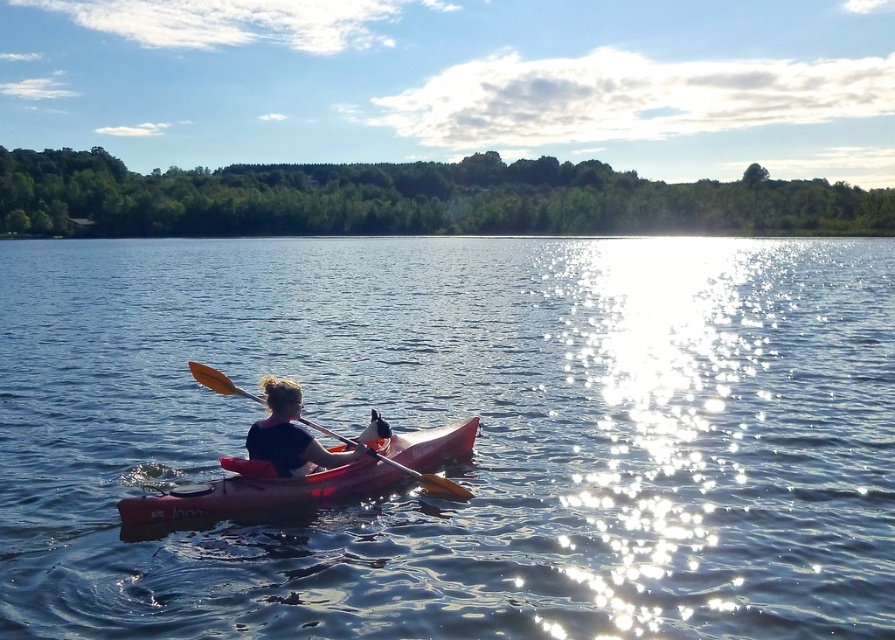
You are a photographer trying to capture the matte pink kayak at center in the image. The camera you are using has a fixed focus point at coordinates point (290, 435). Will this focus point align with the kayak?

Yes, the point (290, 435) marks the matte pink kayak at center, so the focus point will align with it.

You are a photographer trying to capture the matte red canoe at center and the orange wood paddle at center in a single shot. Since you want the canoe to be the main focus, which object should you adjust your camera lens to prioritize in terms of depth of field?

The matte red canoe at center is closer to the viewer than the orange wood paddle at center, so adjusting the depth of field to focus on the canoe will keep it sharp while naturally blurring the paddle in the background.

You are a photographer planning to take a photo of the matte red canoe at center. The camera you are using has a focal length of 50mm. To ensure the canoe is in focus, you need to know its position relative to the point marked at coordinates point (258, 490). Is the matte red canoe at center located at that point?

The point (258, 490) marks the matte red canoe at center, so yes, the matte red canoe at center is exactly at that point.